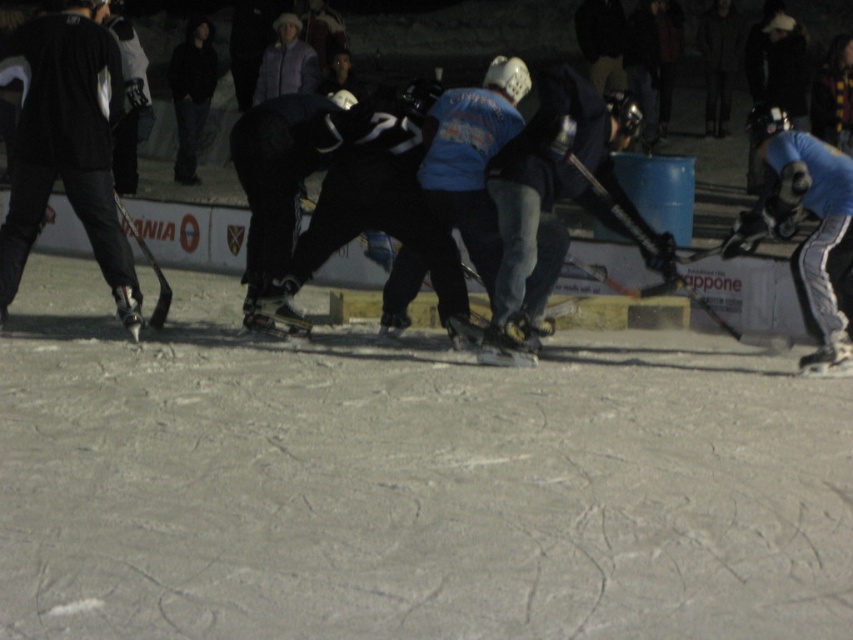
Is point (0, 310) less distant than point (749, 236)?

No.

Is black matte pants at left above blue matte hockey stick at right?

Indeed, black matte pants at left is positioned over blue matte hockey stick at right.

From the picture: Who is more forward, (88, 236) or (824, 275)?

Point (824, 275) is in front.

Locate an element on the screen. This screenshot has width=853, height=640. black matte pants at left is located at coordinates (67, 147).

Is shiny black hockey stick at right positioned in front of shiny black hockey stick at left?

Yes, it is.

Who is lower down, shiny black hockey stick at right or shiny black hockey stick at left?

shiny black hockey stick at right is below.

In order to click on shiny black hockey stick at right in this screenshot , I will do `click(730, 324)`.

At what (x,y) coordinates should I click in order to perform the action: click on blue matte hockey stick at right. Please return your answer as a coordinate pair (x, y). This screenshot has width=853, height=640. Looking at the image, I should click on (810, 234).

You are a GUI agent. You are given a task and a screenshot of the screen. Output one action in this format:
    pyautogui.click(x=<x>, y=<y>)
    Task: Click on the blue matte hockey stick at right
    This screenshot has height=640, width=853.
    Given the screenshot: What is the action you would take?
    pyautogui.click(x=810, y=234)